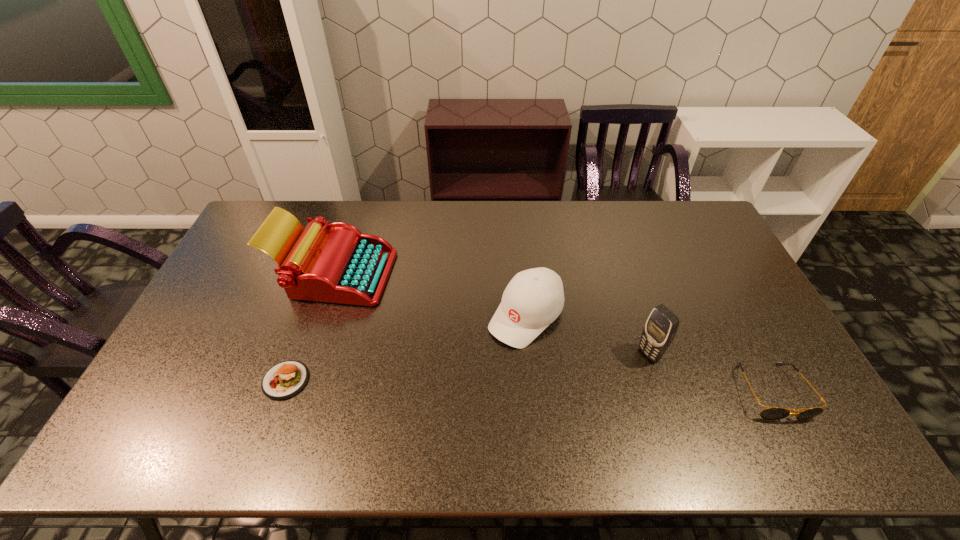
In order to click on vacant region that satisfies the following two spatial constraints: 1. on the back side of the typewriter; 2. on the left side of the shortest object in this screenshot , I will do `click(324, 272)`.

This screenshot has width=960, height=540. I want to click on free space that satisfies the following two spatial constraints: 1. on the back side of the shortest object; 2. on the left side of the typewriter, so click(x=324, y=272).